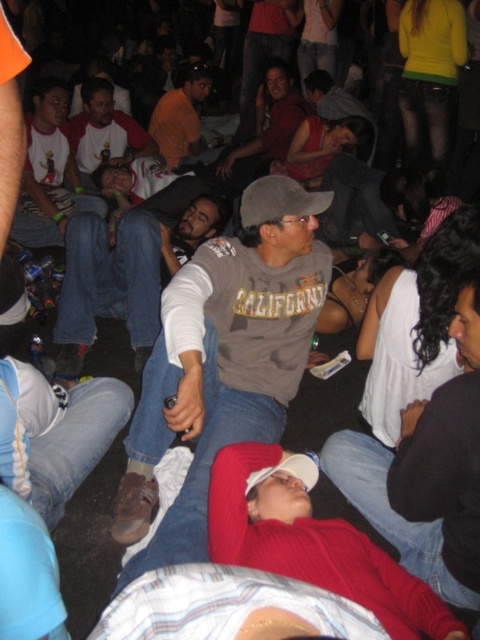
Question: Which object is farther from the camera taking this photo?

Choices:
 (A) matte white shirt at center
 (B) gray fabric baseball cap at center

Answer: (A)

Question: Considering the real-world distances, which object is farthest from the matte white shirt at center?

Choices:
 (A) matte red shirt at center
 (B) orange cotton shirt at center
 (C) matte gray sweatshirt at center
 (D) gray fabric baseball cap at center

Answer: (C)

Question: Is white t-shirt at center above matte red shirt at center?

Choices:
 (A) no
 (B) yes

Answer: (A)

Question: Does matte red shirt at center have a smaller size compared to gray fabric baseball cap at center?

Choices:
 (A) yes
 (B) no

Answer: (B)

Question: Estimate the real-world distances between objects in this image. Which object is closer to the matte red shirt at center?

Choices:
 (A) matte white shirt at center
 (B) orange cotton shirt at center

Answer: (B)

Question: Can you confirm if white t-shirt at center is thinner than orange cotton shirt at center?

Choices:
 (A) yes
 (B) no

Answer: (B)